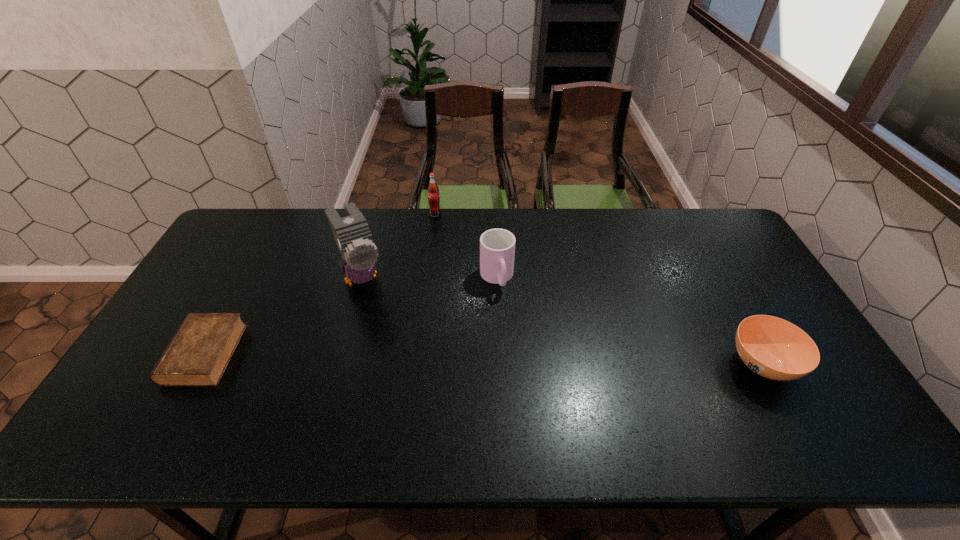
Locate an element on the screen. The height and width of the screenshot is (540, 960). vacant space on the desktop that is between the diary and the second shortest object and is positioned at the beak of the tallest object is located at coordinates (403, 357).

The image size is (960, 540). What are the coordinates of `vacant spot on the desktop that is between the shortest object and the soup bowl and is positioned on the label of the second tallest object` in the screenshot? It's located at (398, 357).

Find the location of a particular element. The height and width of the screenshot is (540, 960). free space on the desktop that is between the shortest object and the soup bowl and is positioned with the handle on the side of the cup is located at coordinates (520, 360).